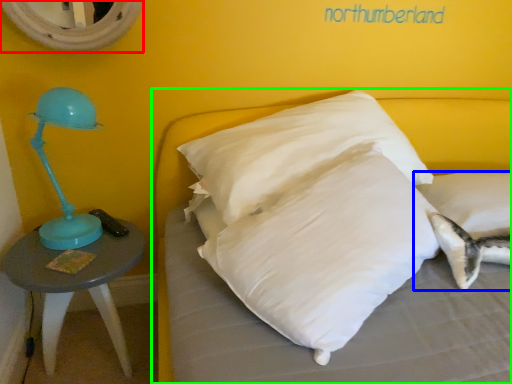
Question: Which is farther away from mirror (highlighted by a red box)? pillow (highlighted by a blue box) or bed (highlighted by a green box)?

Choices:
 (A) pillow
 (B) bed

Answer: (A)